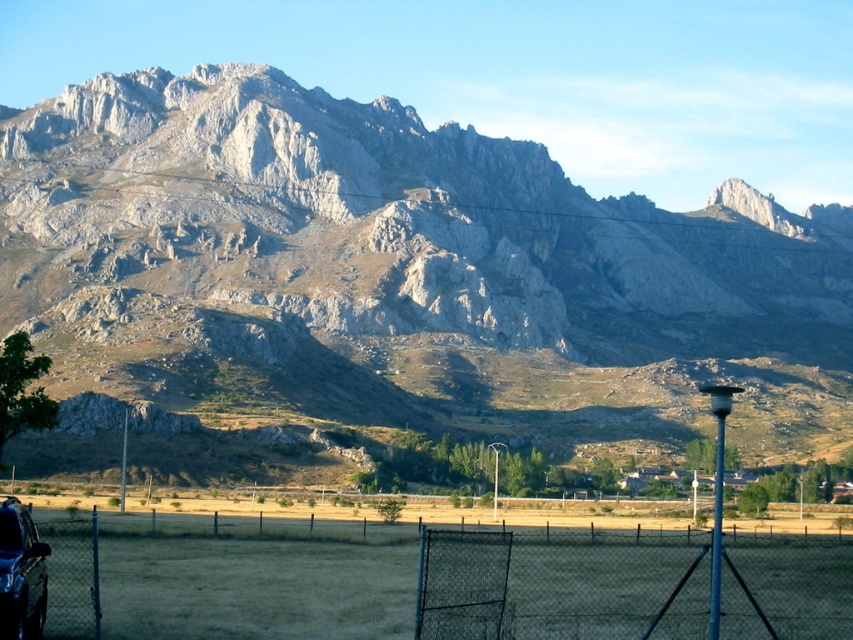
You are a photographer planning to capture a landscape shot that includes both the gray rock mountain range at upper center and the shiny black car at lower left. Given their sizes, which object should you focus on first to ensure it is in sharp focus if you want both to be clear?

The gray rock mountain range at upper center is larger than the shiny black car at lower left, so focusing on the larger object first will help ensure both are in sharp focus.